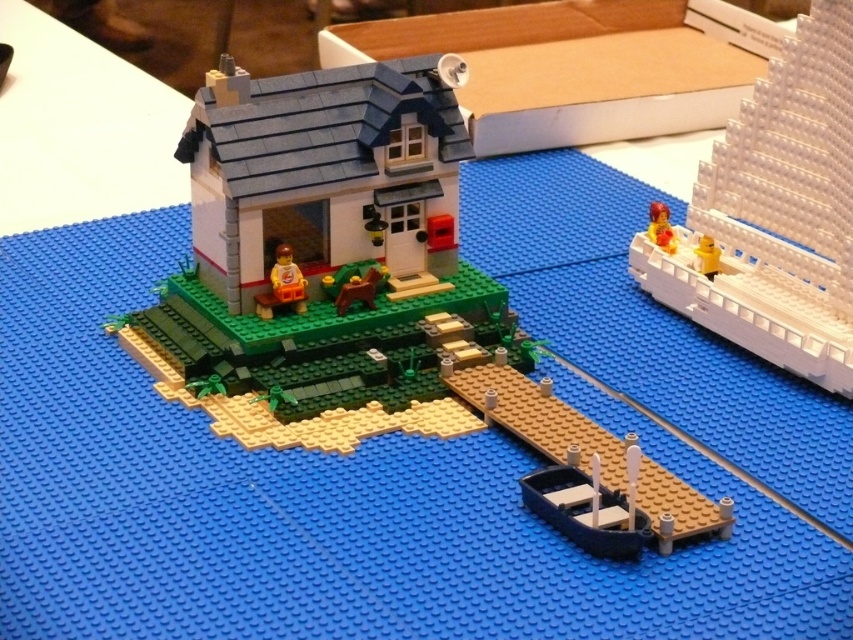
You are designing a LEGO display and want to place the smooth dark blue boat at lower center and the yellow plastic minifigure at right on the same LEGO baseplate. Considering their sizes, which object will occupy more horizontal space on the baseplate?

The smooth dark blue boat at lower center will occupy more horizontal space on the baseplate since its width surpasses that of the yellow plastic minifigure at right.